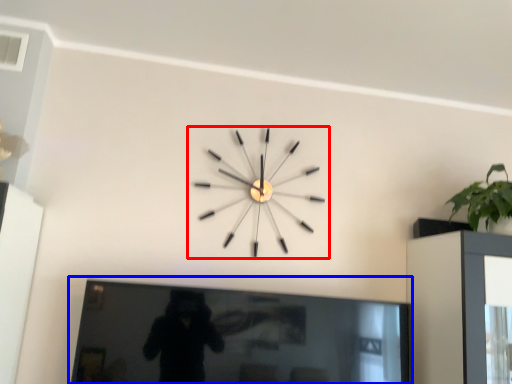
Question: Which point is further to the camera, wall clock (highlighted by a red box) or picture frame (highlighted by a blue box)?

Choices:
 (A) wall clock
 (B) picture frame

Answer: (A)